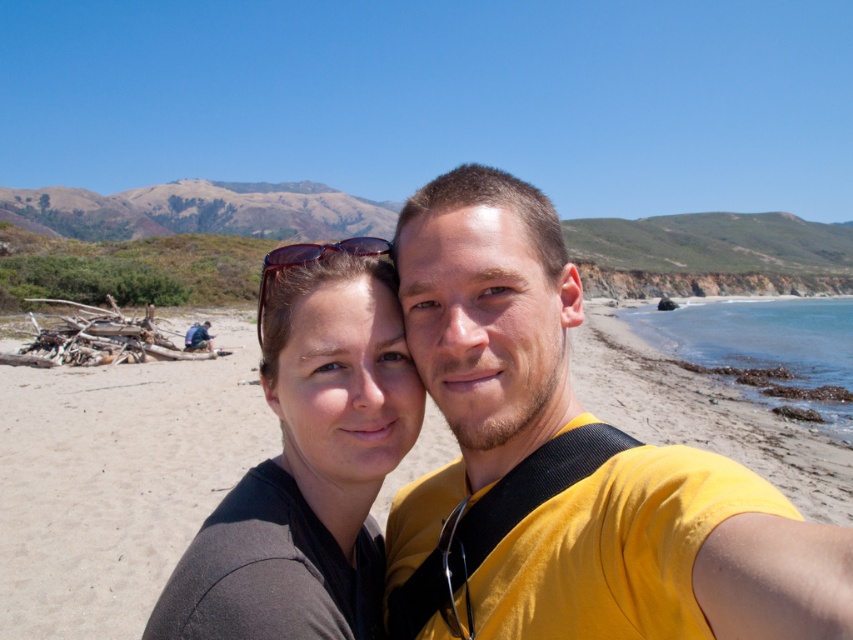
You are taking a photo of the yellow matte shirt at center and the sandy beach at center. Which object is nearer to you in the image?

The yellow matte shirt at center is closer to the viewer than the sandy beach at center.

You are a photographer trying to capture a landscape shot of the sandy beach at center and the matte black sunglasses at center in the foreground. Which object should you focus on first if you want both to be in sharp focus?

The sandy beach at center has a greater height compared to the matte black sunglasses at center, so focusing on the sandy beach at center first would ensure both are in sharp focus.